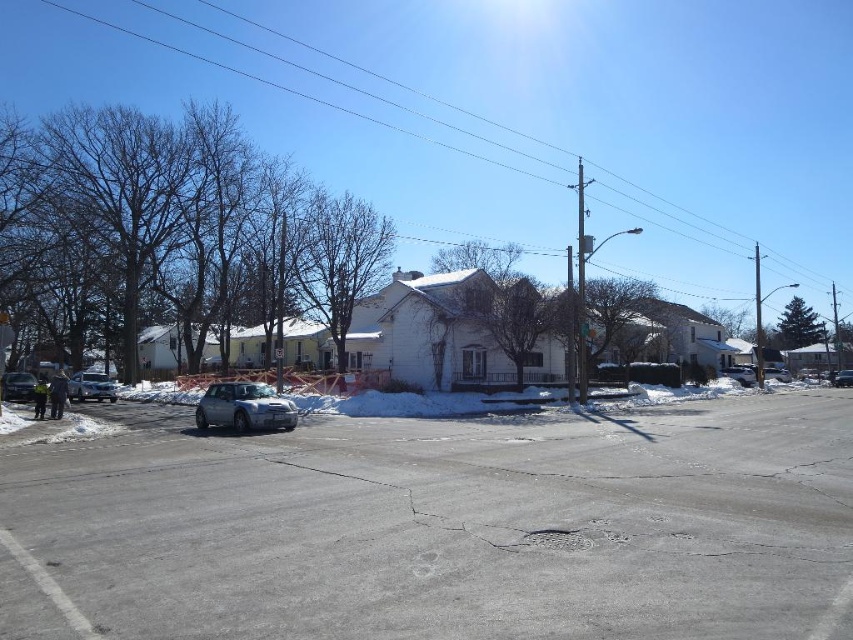
Question: Considering the relative positions of silver metallic sedan at left and satin silver sedan at center in the image provided, where is silver metallic sedan at left located with respect to satin silver sedan at center?

Choices:
 (A) left
 (B) right

Answer: (A)

Question: In this image, where is shiny silver sedan at lower left located relative to silver metallic sedan at center-right?

Choices:
 (A) left
 (B) right

Answer: (A)

Question: Based on their relative distances, which object is farther from the silver metallic sedan at center-right?

Choices:
 (A) silver metallic sedan at left
 (B) satin silver sedan at center
 (C) satin silver sedan at right

Answer: (A)

Question: Does silver metallic sedan at left have a lesser width compared to shiny silver sedan at lower left?

Choices:
 (A) no
 (B) yes

Answer: (A)

Question: Which object is the farthest from the silver metallic sedan at center-right?

Choices:
 (A) shiny silver sedan at lower left
 (B) silver metallic sedan at left

Answer: (A)

Question: Which of the following is the closest to the observer?

Choices:
 (A) satin silver sedan at center
 (B) silver metallic sedan at left

Answer: (B)